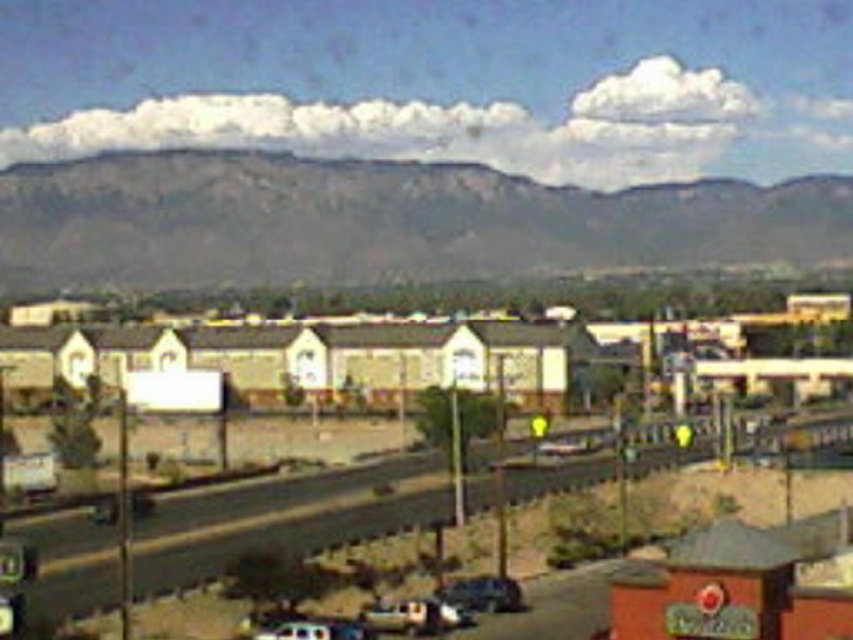
You are standing at the base of the rugged stone mountain at upper center and want to reach the red building in the bottom right corner. The red building is 300 meters away from your current position. Can you safely walk directly to the red building without needing to climb the mountain?

The rugged stone mountain at upper center is 245.57 meters away from the viewer. Since the red building is 300 meters away from your current position, you can safely walk directly to the red building without needing to climb the mountain as the distance to the building is greater than the distance to the mountain, implying it is beyond the mountain and accessible via the path around it.

You are a delivery driver who needs to park your truck, which is as wide as the shiny black car at lower center, between two beige stucco houses at center. Based on the scene, will there be enough space between the two houses for your truck?

The beige stucco houses at center are wider than the shiny black car at lower center. Since the truck is as wide as the car, there should be sufficient space between the two houses for the truck to park.